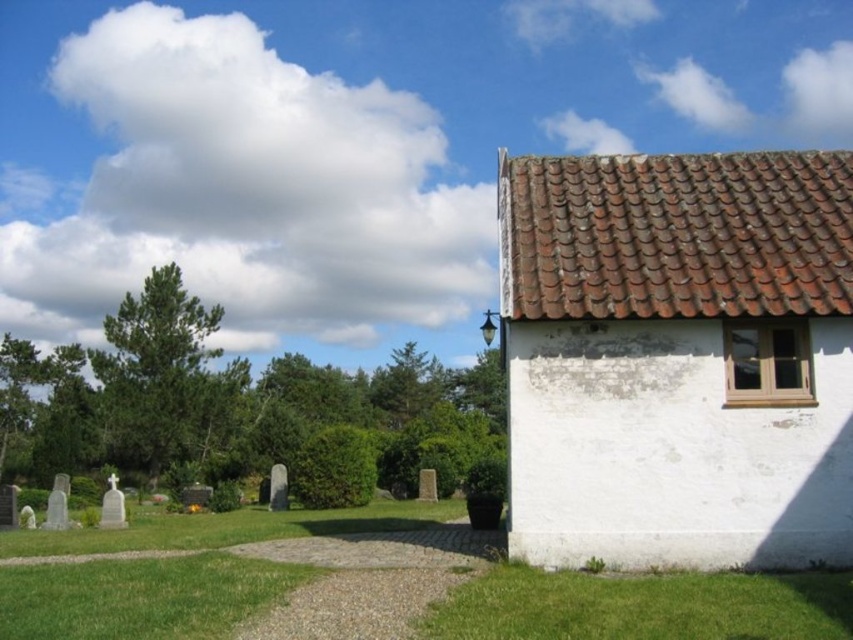
Question: Can you confirm if green grass at lower right is smaller than green grass at lower left?

Choices:
 (A) no
 (B) yes

Answer: (A)

Question: Does green grass at lower right come in front of green grass at lower left?

Choices:
 (A) yes
 (B) no

Answer: (A)

Question: Does green grass at lower right have a larger size compared to green grass at lower left?

Choices:
 (A) no
 (B) yes

Answer: (B)